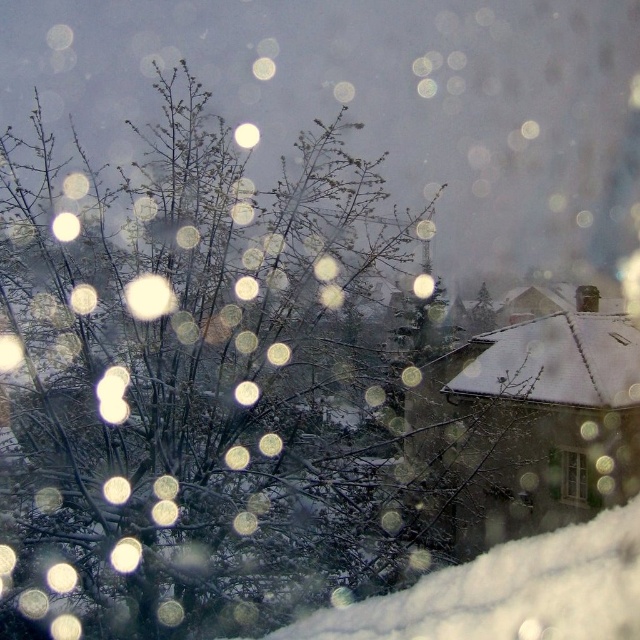
Question: Does white fluffy snow at lower right have a greater width compared to clear glass window at lower right?

Choices:
 (A) no
 (B) yes

Answer: (B)

Question: Which point is closer to the camera?

Choices:
 (A) clear glass window at lower right
 (B) white fluffy snow at lower right

Answer: (B)

Question: Can you confirm if white fluffy snow at lower right is wider than clear glass window at lower right?

Choices:
 (A) no
 (B) yes

Answer: (B)

Question: Can you confirm if white fluffy snow at lower right is bigger than clear glass window at lower right?

Choices:
 (A) yes
 (B) no

Answer: (A)